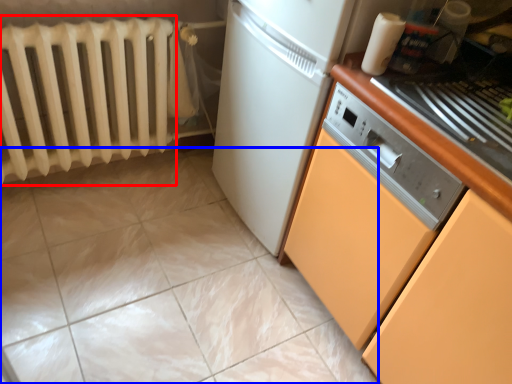
Question: Which point is further to the camera, radiator (highlighted by a red box) or ceramic tile (highlighted by a blue box)?

Choices:
 (A) radiator
 (B) ceramic tile

Answer: (A)